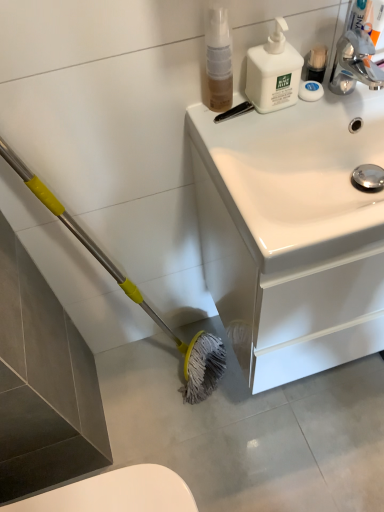
Locate an element on the screen. Image resolution: width=384 pixels, height=512 pixels. vacant space in front of white matte pump bottle at upper right, which appears as the 1th cleaning product when viewed from the right is located at coordinates (269, 130).